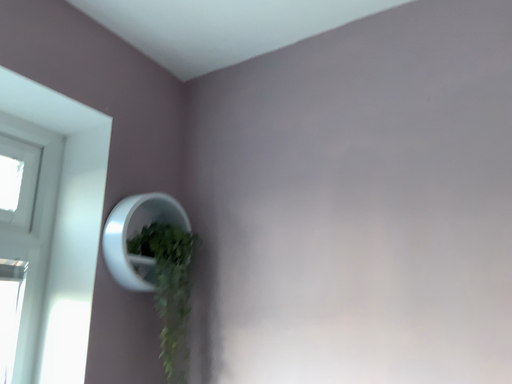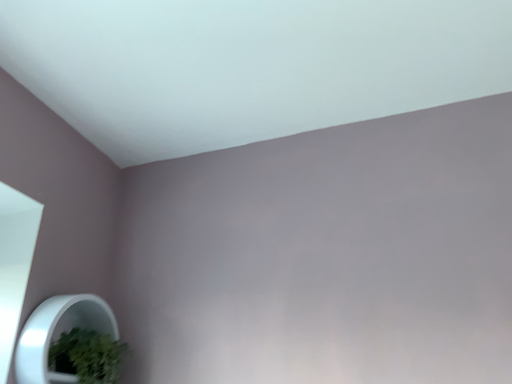
Question: How did the camera likely rotate when shooting the video?

Choices:
 (A) rotated upward
 (B) rotated downward

Answer: (A)